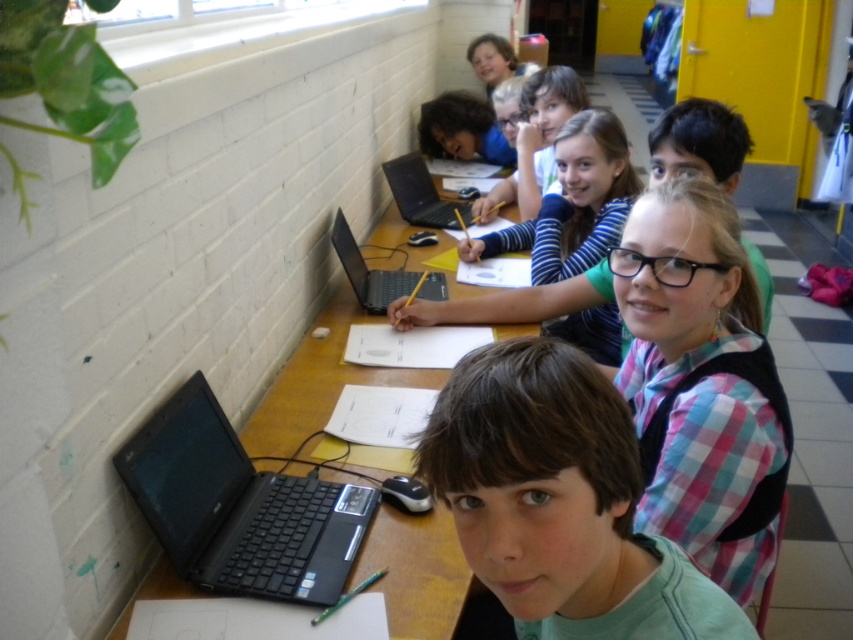
Can you confirm if plaid fabric shirt at center is positioned above pink plaid shirt at center?

Actually, plaid fabric shirt at center is below pink plaid shirt at center.

Is plaid fabric shirt at center closer to camera compared to pink plaid shirt at center?

Yes, it is.

Between point (685, 288) and point (746, 131), which one is positioned in front?

Point (685, 288) is in front.

Where is `plaid fabric shirt at center`? This screenshot has height=640, width=853. plaid fabric shirt at center is located at coordinates (700, 385).

Between point (637, 358) and point (244, 506), which one is positioned behind?

Point (637, 358)

Find the location of a particular element. The width and height of the screenshot is (853, 640). plaid fabric shirt at center is located at coordinates (700, 385).

At what (x,y) coordinates should I click in order to perform the action: click on plaid fabric shirt at center. Please return your answer as a coordinate pair (x, y). Image resolution: width=853 pixels, height=640 pixels. Looking at the image, I should click on (700, 385).

Is black plastic laptop at lower left above black plastic laptop at center?

Actually, black plastic laptop at lower left is below black plastic laptop at center.

Find the location of a particular element. black plastic laptop at lower left is located at coordinates (239, 508).